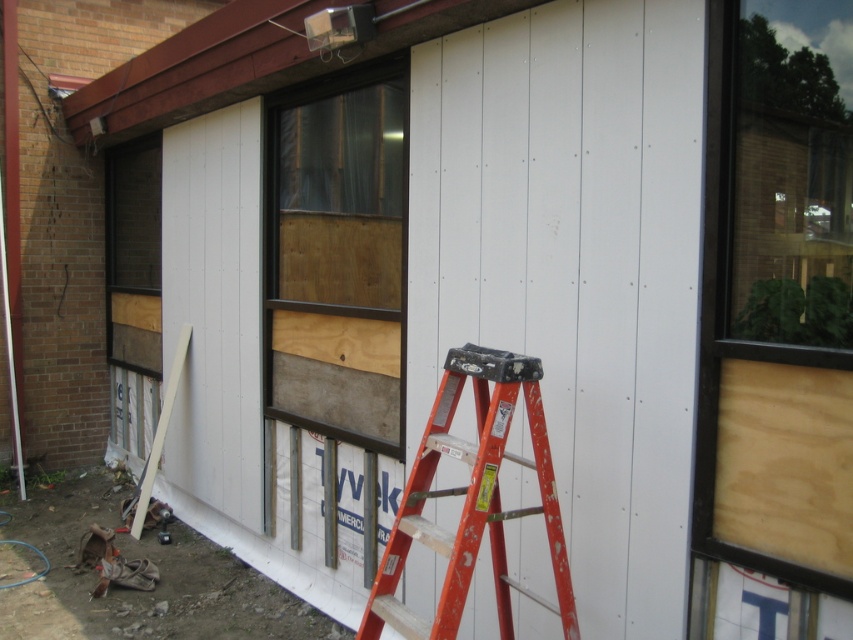
Which is in front, point (422, 472) or point (109, 269)?

Point (422, 472) is more forward.

Is metallic orange ladder at center to the right of wooden paneling at left from the viewer's perspective?

Correct, you'll find metallic orange ladder at center to the right of wooden paneling at left.

Which is behind, point (492, 502) or point (144, 352)?

Point (144, 352)

You are a GUI agent. You are given a task and a screenshot of the screen. Output one action in this format:
    pyautogui.click(x=<x>, y=<y>)
    Task: Click on the metallic orange ladder at center
    Image resolution: width=853 pixels, height=640 pixels.
    Given the screenshot: What is the action you would take?
    pyautogui.click(x=473, y=500)

Who is lower down, brown wood window at center or metallic orange ladder at center?

metallic orange ladder at center is lower down.

Is brown wood window at center bigger than metallic orange ladder at center?

Correct, brown wood window at center is larger in size than metallic orange ladder at center.

The width and height of the screenshot is (853, 640). In order to click on brown wood window at center in this screenshot , I will do `click(335, 256)`.

Can you confirm if white smooth siding at center is wider than brown wood window at center?

Correct, the width of white smooth siding at center exceeds that of brown wood window at center.

Can you confirm if white smooth siding at center is smaller than brown wood window at center?

No, white smooth siding at center is not smaller than brown wood window at center.

Which is in front, point (482, 298) or point (352, 77)?

Point (482, 298)

Identify the location of white smooth siding at center. (427, 269).